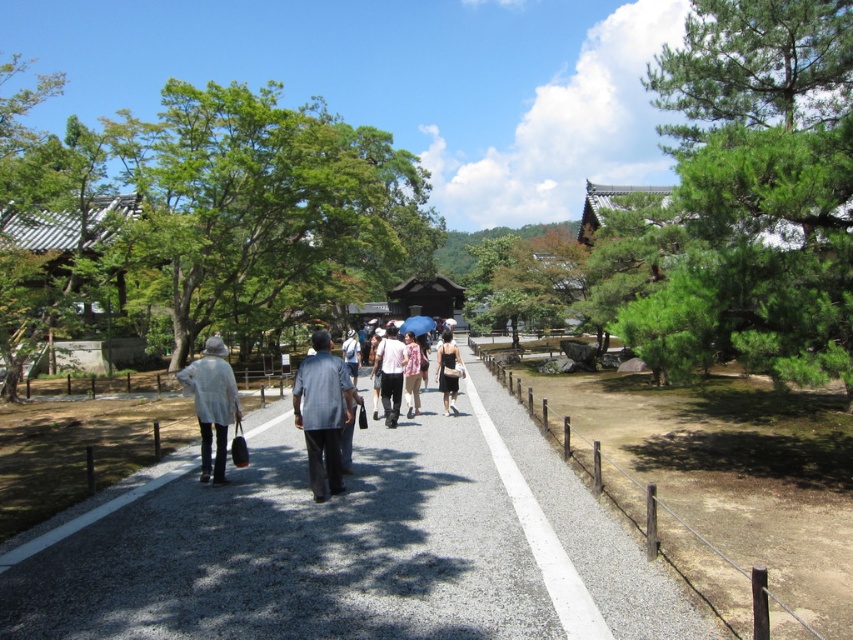
Question: Which point is closer to the camera taking this photo?

Choices:
 (A) (331, 196)
 (B) (624, 298)
 (C) (192, 396)

Answer: (C)

Question: Which point is farther from the camera taking this photo?

Choices:
 (A) (318, 381)
 (B) (204, 388)
 (C) (165, 196)
 (D) (399, 326)

Answer: (D)

Question: Does white textured coat at center come in front of black satin dress at center?

Choices:
 (A) yes
 (B) no

Answer: (A)

Question: Observing the image, what is the correct spatial positioning of light blue denim shirt at center in reference to blue fabric umbrella at center?

Choices:
 (A) right
 (B) left

Answer: (B)

Question: Which point is farther from the camera taking this photo?

Choices:
 (A) (341, 349)
 (B) (263, 320)
 (C) (450, 404)
 (D) (206, 428)

Answer: (B)

Question: Does black satin dress at center have a lesser width compared to pink cotton shirt at center?

Choices:
 (A) yes
 (B) no

Answer: (B)